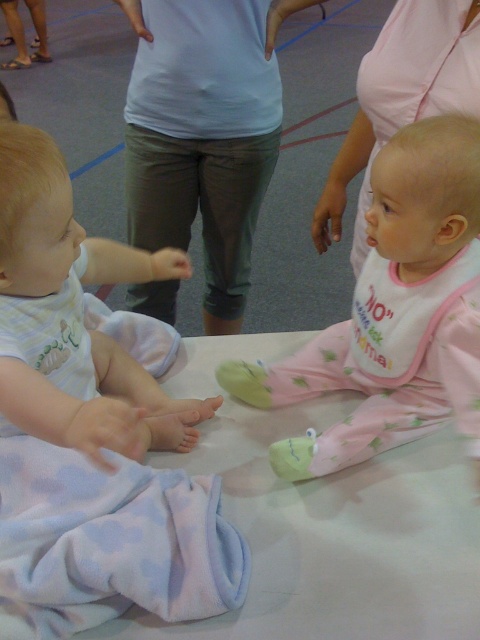
You are a parent trying to dress your baby. You have a light blue fabric pants at center and a white fabric bib at center. Which item is bigger in size?

The light blue fabric pants at center has a larger size compared to the white fabric bib at center.

You are a photographer trying to capture the exact position of the light blue fabric pants at center in this image. According to the coordinates given, what are the coordinates where you should aim your camera?

The coordinates for the light blue fabric pants at center are at point (x=204, y=132).